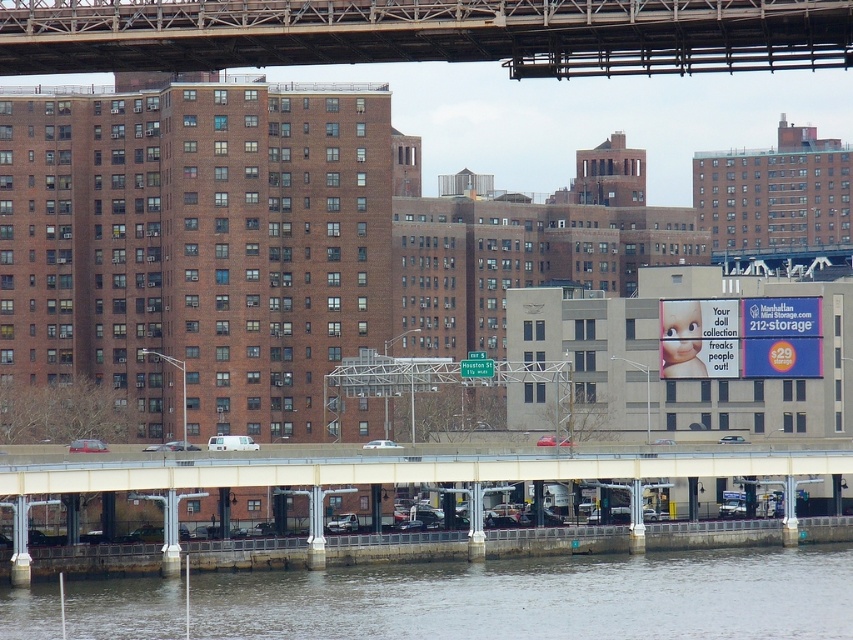
You are a delivery driver approaching the concrete bridge at lower center. You notice the gray concrete river at lower center below. Based on their heights, which one is more likely to be above the other?

The concrete bridge at lower center is taller than the gray concrete river at lower center, so the concrete bridge at lower center is above the gray concrete river at lower center.

You are standing at the bridge on the image and want to reach a point that is 135.52 meters away from you. Is the point at coordinates point (349, 572) within your reach?

The point (349, 572) is exactly 135.52 meters away from the viewer, so yes, it is within your reach if you can travel that distance.

You are standing at the edge of the gray concrete river at lower center and want to throw a stone into the water. Considering the distance from where you are standing to the camera position is 101.06 meters, will the stone reach the water if you throw it with a maximum range of 50 meters?

The gray concrete river at lower center is 101.06 meters away from the camera, so if you are standing at the edge of the river, the distance to the camera is 101.06 meters. However, your maximum throwing range is 50 meters, which is less than the required distance. Therefore, the stone will not reach the water.